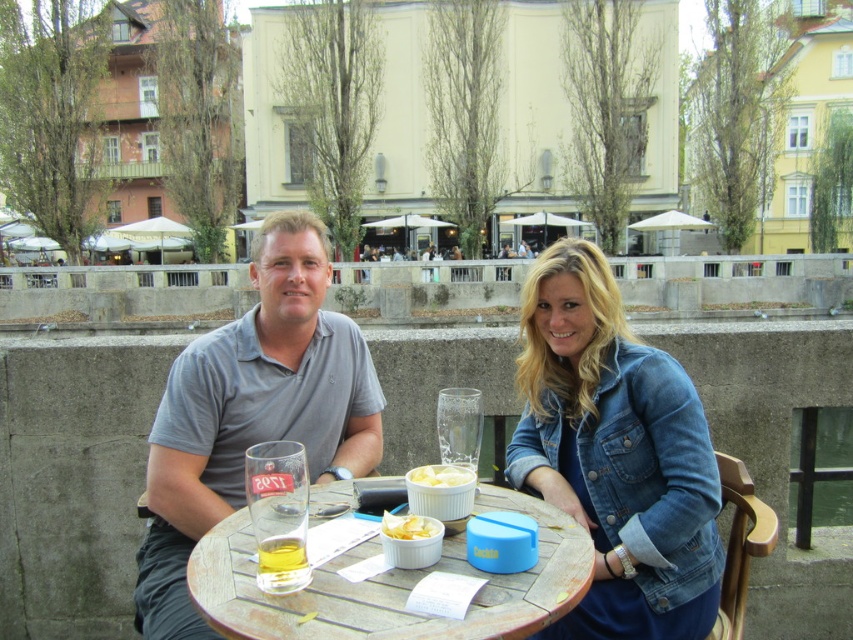
Question: Which point is farther from the camera taking this photo?

Choices:
 (A) (389, 515)
 (B) (532, 513)

Answer: (B)

Question: Which object is the closest to the yellow crumbly cheese at center?

Choices:
 (A) denim jacket at lower right
 (B) wooden table at center

Answer: (B)

Question: Considering the relative positions of denim jacket at lower right and translucent glass cup at table center in the image provided, where is denim jacket at lower right located with respect to translucent glass cup at table center?

Choices:
 (A) above
 (B) below

Answer: (B)

Question: Can you confirm if gray cotton shirt at left is positioned to the right of wooden table at center?

Choices:
 (A) yes
 (B) no

Answer: (A)

Question: Among these objects, which one is nearest to the camera?

Choices:
 (A) gray cotton polo shirt at center
 (B) yellow crumbly cheese at center
 (C) wooden table at center
 (D) denim jacket at lower right

Answer: (C)

Question: Does wooden table at center appear under yellow crumbly cheese at center?

Choices:
 (A) no
 (B) yes

Answer: (B)